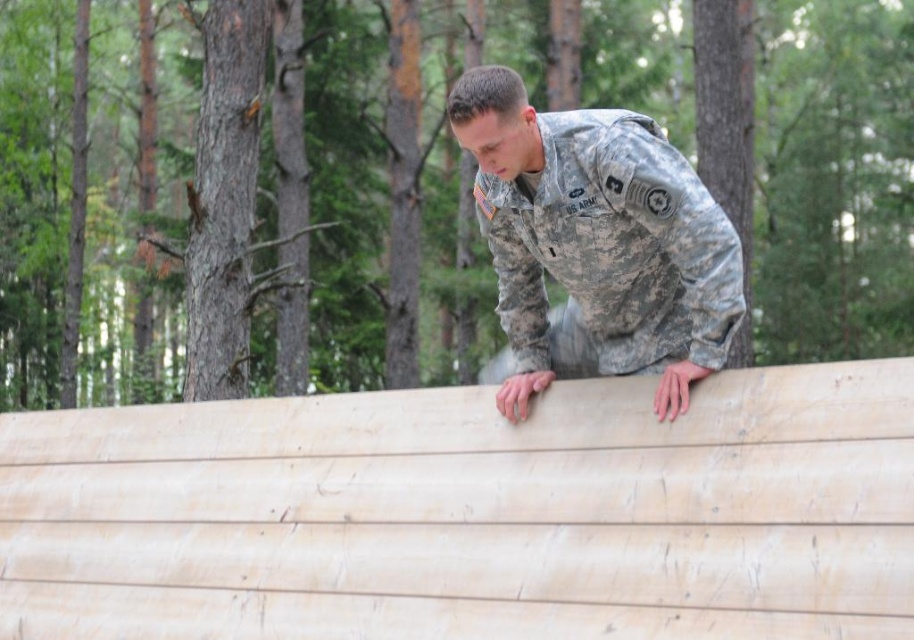
Consider the image. Does natural wood plywood at upper center have a greater width compared to camouflage fabric soldier at center?

Yes, natural wood plywood at upper center is wider than camouflage fabric soldier at center.

Is point (810, 490) positioned behind point (709, 246)?

No, (810, 490) is closer to viewer.

Is point (128, 582) closer to viewer compared to point (592, 168)?

No.

The image size is (914, 640). Find the location of `natural wood plywood at upper center`. natural wood plywood at upper center is located at coordinates (471, 513).